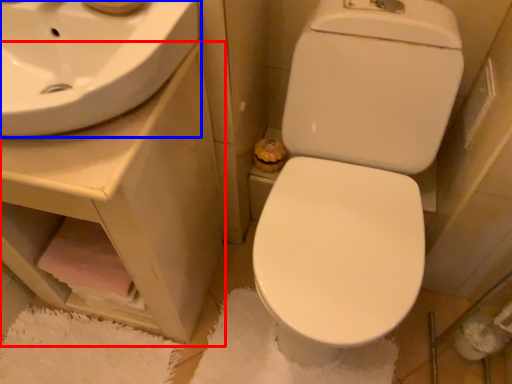
Question: Which of the following is the closest to the observer, counter top (highlighted by a red box) or sink (highlighted by a blue box)?

Choices:
 (A) counter top
 (B) sink

Answer: (B)